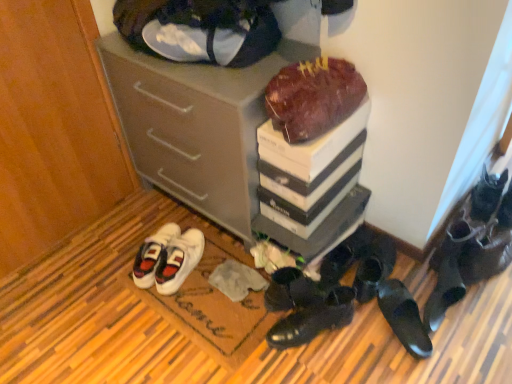
Locate an element on the screen. This screenshot has width=512, height=384. free point above black leather shoes at lower right, which is the seventh footwear in right-to-left order (from a real-world perspective) is located at coordinates (302, 288).